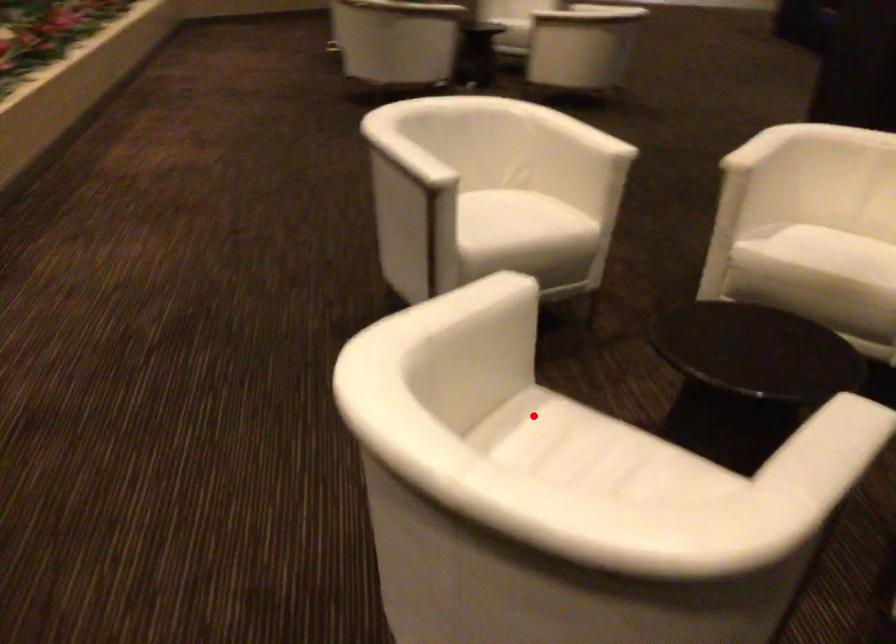
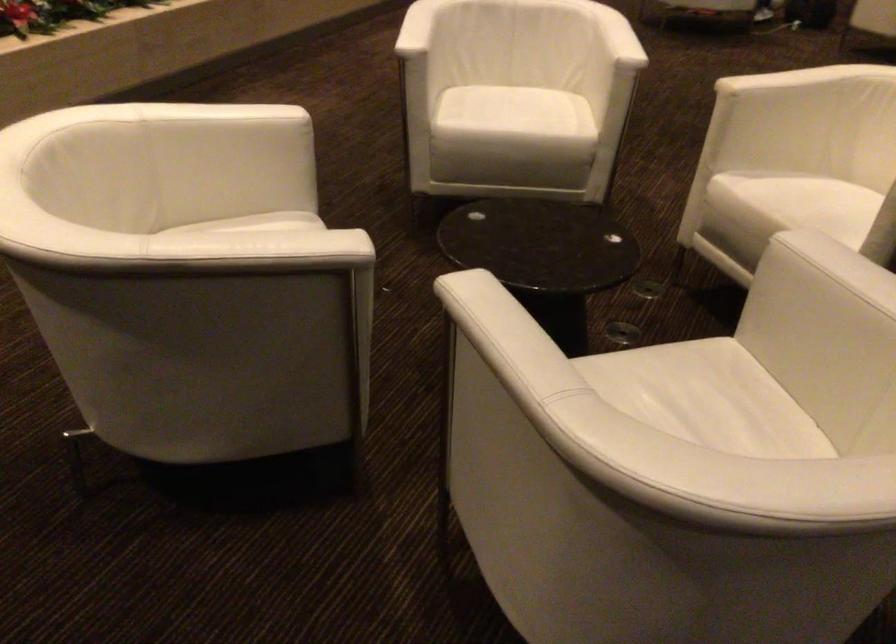
The point at the highlighted location is marked in the first image. Where is the corresponding point in the second image?

(265, 223)